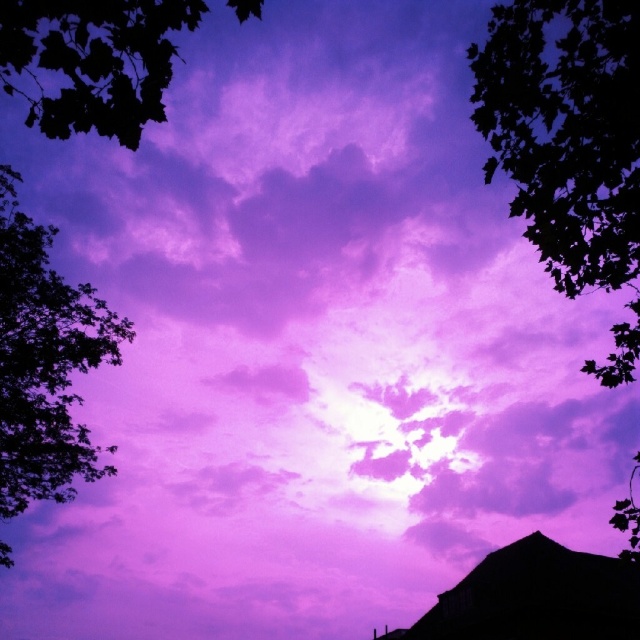
Question: Is green leafy tree at upper left positioned in front of silhouette wooden hut at bottom right?

Choices:
 (A) no
 (B) yes

Answer: (B)

Question: Does dark green leafy tree at upper right appear under dark green leafy tree at left?

Choices:
 (A) no
 (B) yes

Answer: (A)

Question: Among these points, which one is farthest from the camera?

Choices:
 (A) (528, 186)
 (B) (588, 628)
 (C) (13, 486)

Answer: (B)

Question: Which is nearer to the silhouette wooden hut at bottom right?

Choices:
 (A) dark green leafy tree at left
 (B) green leafy tree at upper left

Answer: (A)

Question: Which point is farther to the camera?

Choices:
 (A) silhouette wooden hut at bottom right
 (B) green leafy tree at upper left
 (C) dark green leafy tree at left

Answer: (A)

Question: Where is dark green leafy tree at left located in relation to silhouette wooden hut at bottom right in the image?

Choices:
 (A) below
 (B) above

Answer: (B)